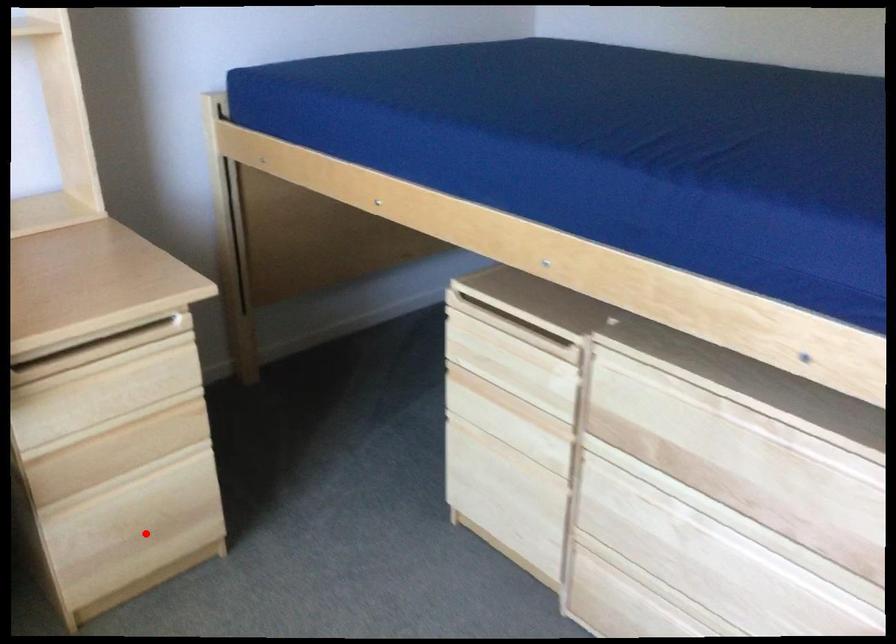
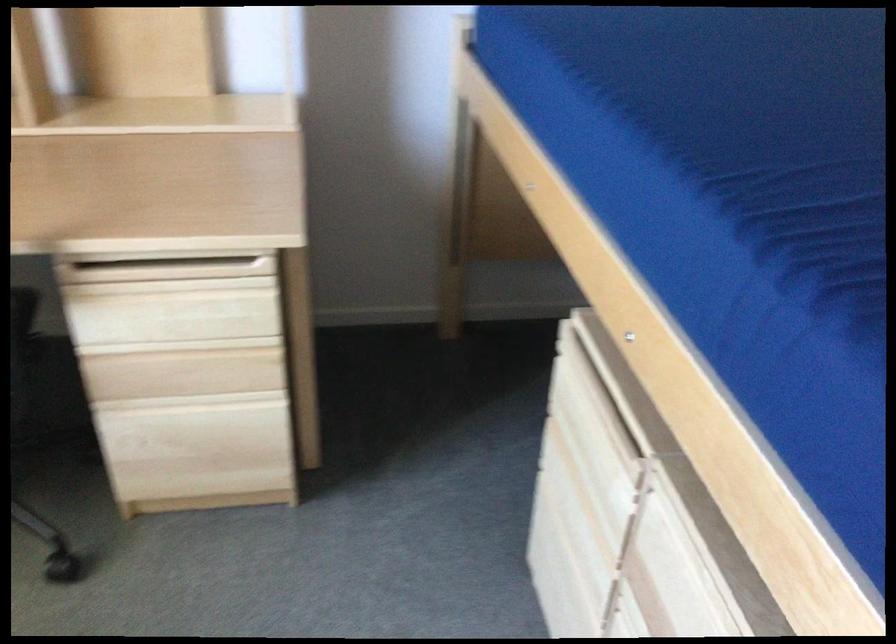
The point at the highlighted location is marked in the first image. Where is the corresponding point in the second image?

(202, 460)